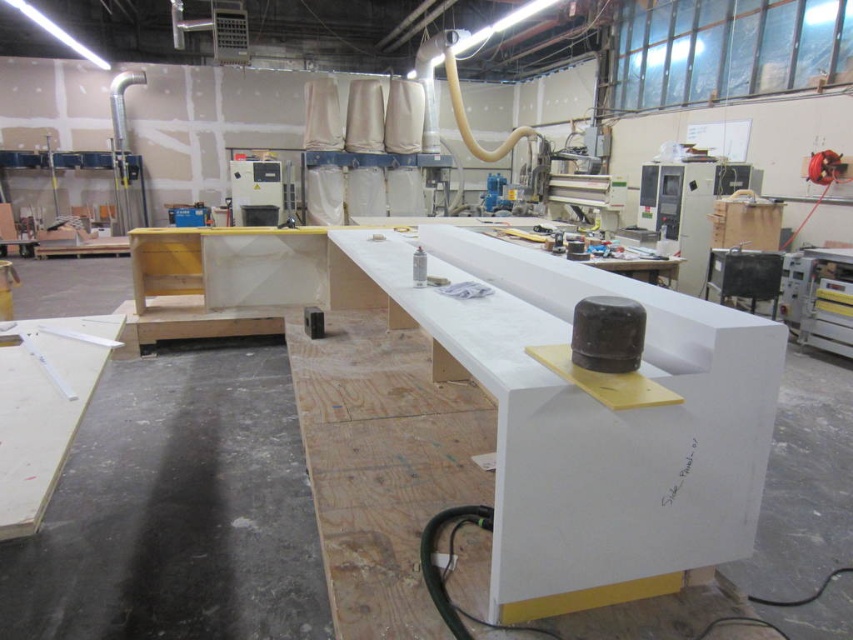
Locate an element on the screen. The height and width of the screenshot is (640, 853). white matte table at center is located at coordinates (595, 420).

Does white matte table at center have a greater width compared to white matte wood table at lower left?

Indeed, white matte table at center has a greater width compared to white matte wood table at lower left.

Does point (744, 472) come in front of point (22, 456)?

Yes, it is.

Identify the location of white matte table at center. (595, 420).